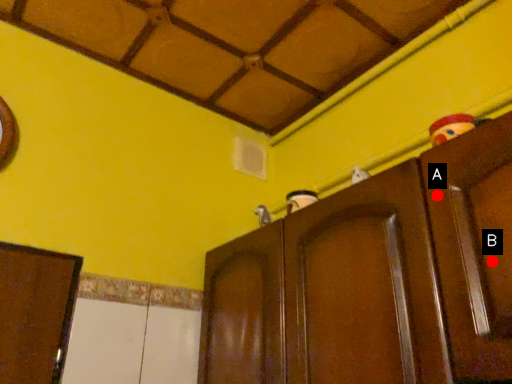
Question: Two points are circled on the image, labeled by A and B beside each circle. Which of the following is the farthest from the observer?

Choices:
 (A) A is further
 (B) B is further

Answer: (A)